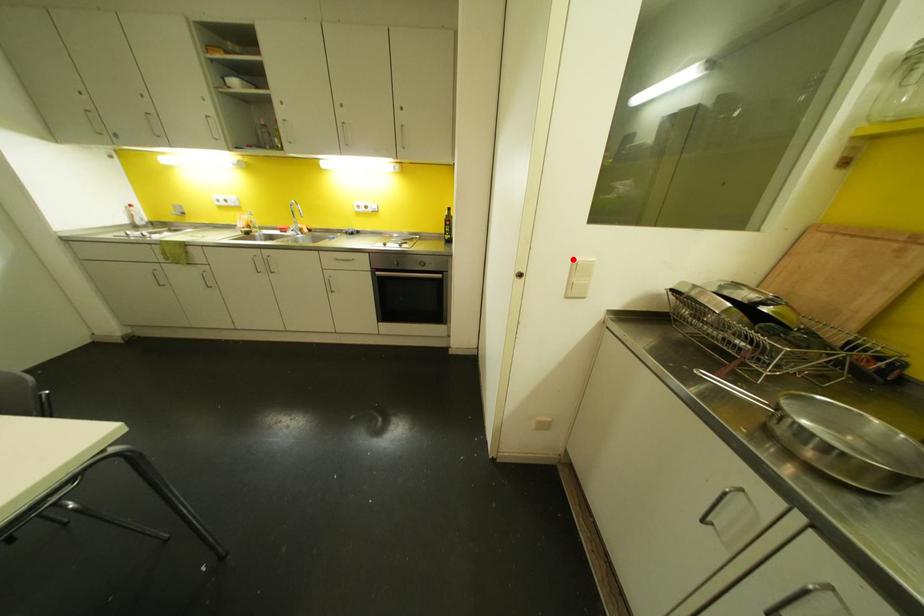
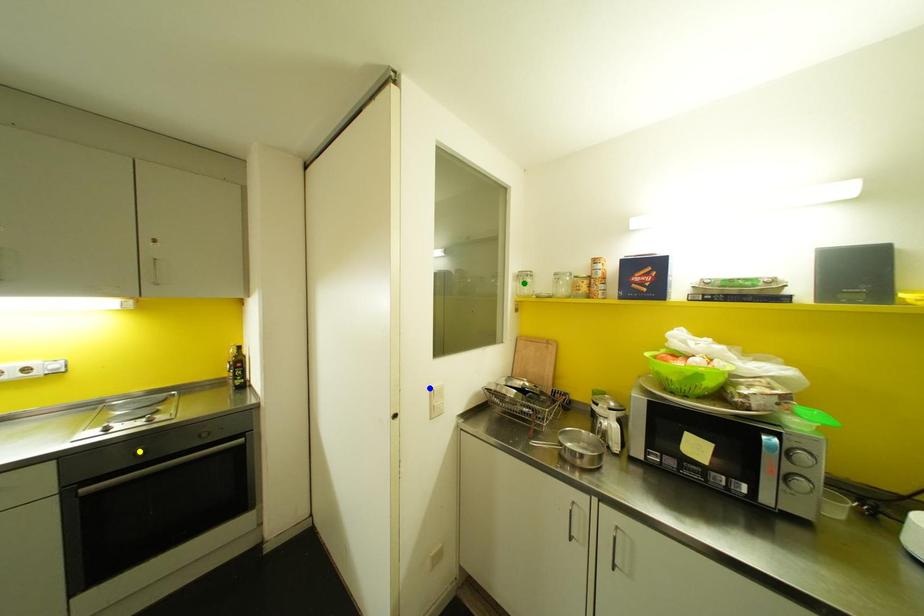
Question: I am providing you with two images of the same scene from different viewpoints. A red point is marked on the first image. You are given multiple points on the second image. Which point in image 2 represents the same 3d spot as the red point in image 1?

Choices:
 (A) green point
 (B) blue point
 (C) yellow point

Answer: (B)